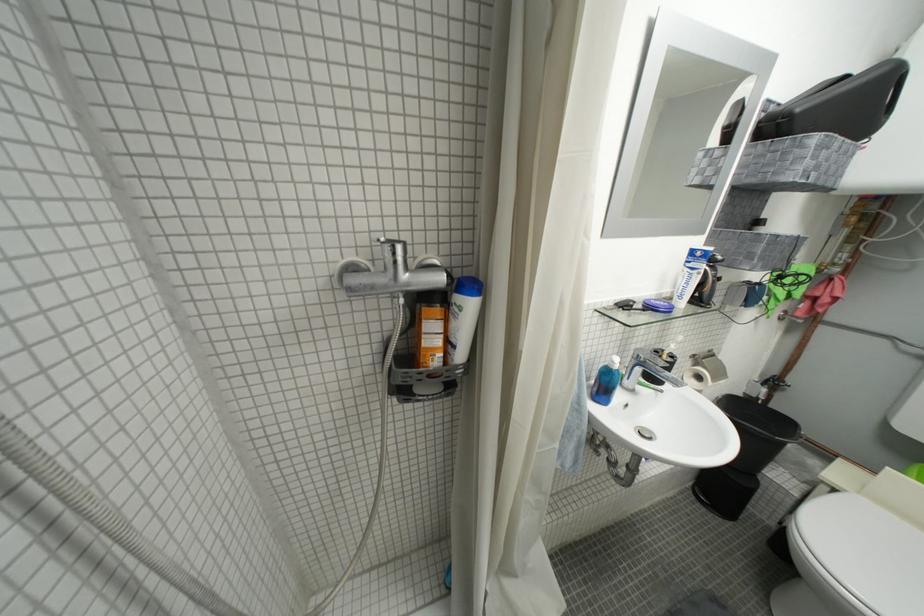
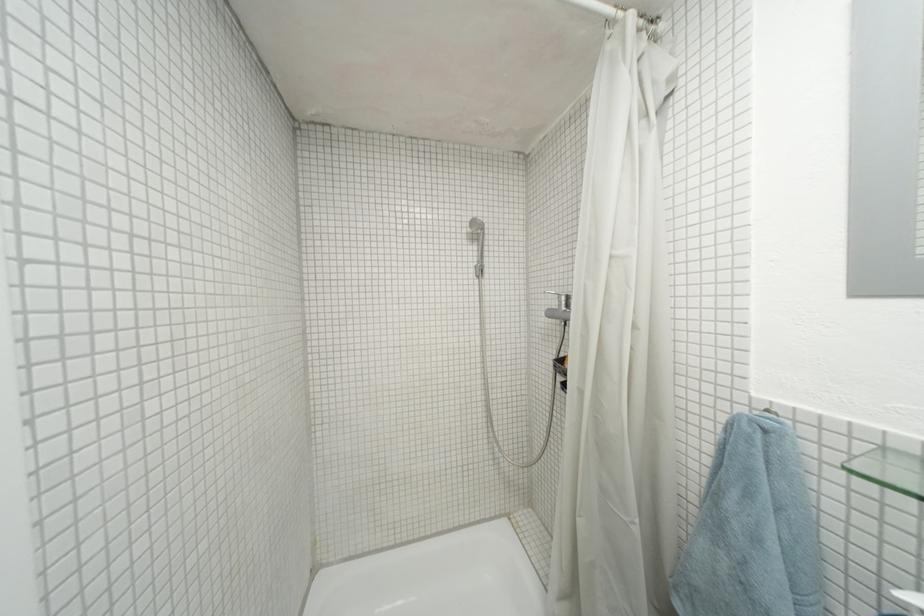
Question: How did the camera likely rotate?

Choices:
 (A) Left
 (B) Right
 (C) Up
 (D) Down

Answer: (A)